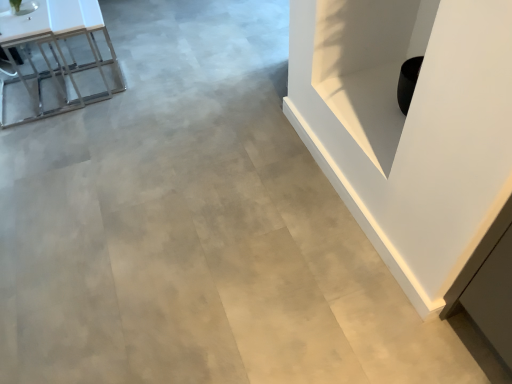
At what (x,y) coordinates should I click in order to perform the action: click on vacant region under metallic silver chair at left (from a real-world perspective). Please return your answer as a coordinate pair (x, y). This screenshot has width=512, height=384. Looking at the image, I should click on (41, 91).